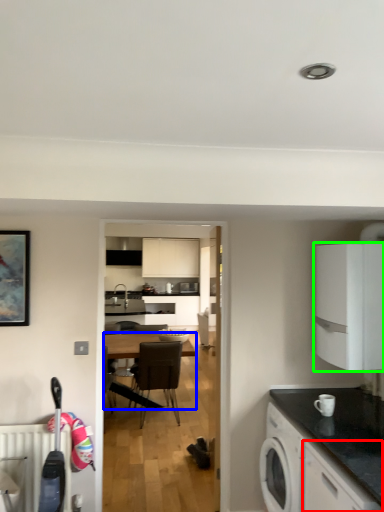
Question: Which object is the farthest from cabinetry (highlighted by a red box)? Choose among these: desk (highlighted by a blue box) or cabinetry (highlighted by a green box).

Choices:
 (A) desk
 (B) cabinetry

Answer: (A)